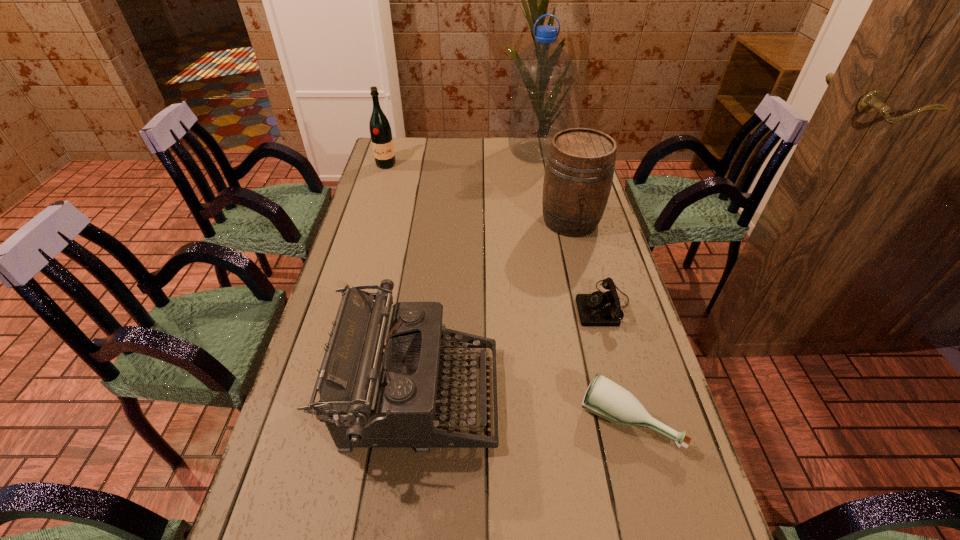
Find the location of a particular element. vacant space located on the typing side of the typewriter is located at coordinates (613, 396).

At what (x,y) coordinates should I click in order to perform the action: click on free point located 0.150m on the back of the bottle. Please return your answer as a coordinate pair (x, y). Looking at the image, I should click on click(x=606, y=336).

This screenshot has width=960, height=540. Identify the location of vacant region located on the front face of the telephone. (487, 305).

Where is `free space located 0.380m on the front face of the telephone`? free space located 0.380m on the front face of the telephone is located at coordinates (440, 305).

Image resolution: width=960 pixels, height=540 pixels. What are the coordinates of `vacant space located 0.180m on the front face of the telephone` in the screenshot? It's located at (512, 305).

Where is `water jug present at the far edge`? The image size is (960, 540). water jug present at the far edge is located at coordinates (542, 75).

What are the coordinates of `liquor positioned at the far edge` in the screenshot? It's located at (380, 131).

This screenshot has height=540, width=960. What are the coordinates of `liquor that is at the left edge` in the screenshot? It's located at click(x=380, y=131).

Find the location of `typewriter positioned at the left edge`. typewriter positioned at the left edge is located at coordinates (378, 383).

Identify the location of water jug situated at the right edge. The width and height of the screenshot is (960, 540). (542, 75).